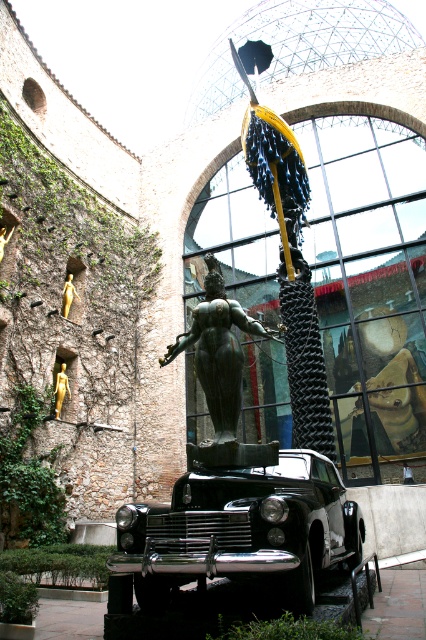
Does point (193, 531) come in front of point (204, 342)?

Yes, point (193, 531) is in front of point (204, 342).

Looking at this image, does shiny black car at center have a larger size compared to bronze statue at center?

Correct, shiny black car at center is larger in size than bronze statue at center.

The image size is (426, 640). I want to click on shiny black car at center, so click(x=238, y=528).

Does bronze statue at center come in front of gold metallic statue at upper left?

Yes, it is.

Does bronze statue at center have a larger size compared to gold metallic statue at upper left?

Indeed, bronze statue at center has a larger size compared to gold metallic statue at upper left.

What do you see at coordinates (221, 372) in the screenshot? I see `bronze statue at center` at bounding box center [221, 372].

The width and height of the screenshot is (426, 640). What are the coordinates of `bronze statue at center` in the screenshot? It's located at (221, 372).

Consider the image. Can you confirm if bronze statue at center is positioned above gold metallic statue at left?

Indeed, bronze statue at center is positioned over gold metallic statue at left.

Who is positioned more to the right, bronze statue at center or gold metallic statue at left?

bronze statue at center is more to the right.

You are a GUI agent. You are given a task and a screenshot of the screen. Output one action in this format:
    pyautogui.click(x=<x>, y=<y>)
    Task: Click on the bronze statue at center
    This screenshot has height=640, width=426.
    Given the screenshot: What is the action you would take?
    pyautogui.click(x=221, y=372)